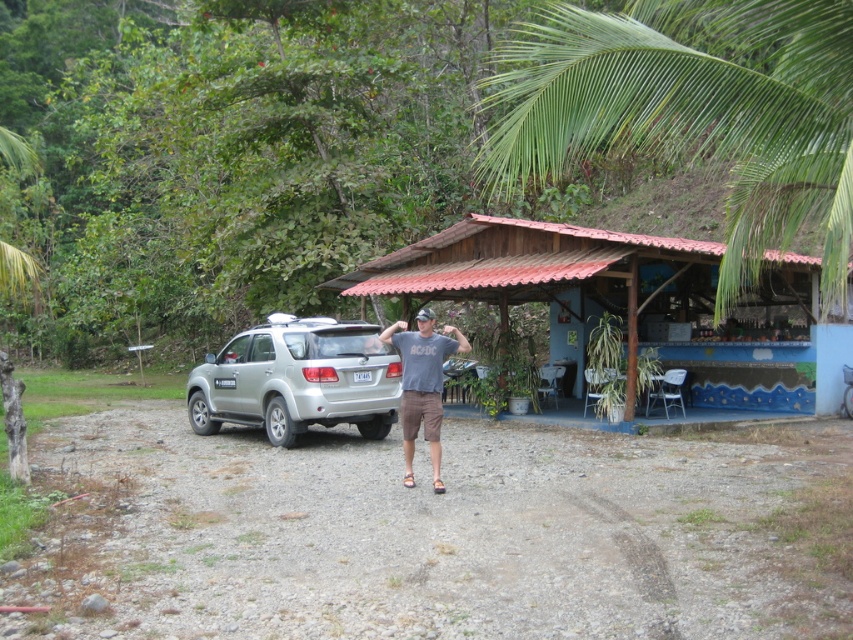
Which is below, green leafy palm tree at upper right or matte gray t-shirt at center?

matte gray t-shirt at center is below.

Does green leafy palm tree at upper right have a lesser width compared to matte gray t-shirt at center?

No, green leafy palm tree at upper right is not thinner than matte gray t-shirt at center.

Is point (787, 147) positioned behind point (432, 390)?

No, (787, 147) is closer to viewer.

Find the location of a particular element. This screenshot has width=853, height=640. green leafy palm tree at upper right is located at coordinates click(694, 109).

Who is lower down, green leafy palm tree at upper right or silver metallic suv at center?

silver metallic suv at center

Who is shorter, green leafy palm tree at upper right or silver metallic suv at center?

Standing shorter between the two is silver metallic suv at center.

Between point (824, 262) and point (311, 400), which one is positioned in front?

Point (824, 262)

At what (x,y) coordinates should I click in order to perform the action: click on green leafy palm tree at upper right. Please return your answer as a coordinate pair (x, y). This screenshot has width=853, height=640. Looking at the image, I should click on (694, 109).

Can you confirm if silver metallic suv at center is positioned below matte gray t-shirt at center?

Yes, silver metallic suv at center is below matte gray t-shirt at center.

Is the position of silver metallic suv at center less distant than that of matte gray t-shirt at center?

That is False.

The width and height of the screenshot is (853, 640). I want to click on silver metallic suv at center, so click(x=297, y=380).

The width and height of the screenshot is (853, 640). I want to click on silver metallic suv at center, so click(x=297, y=380).